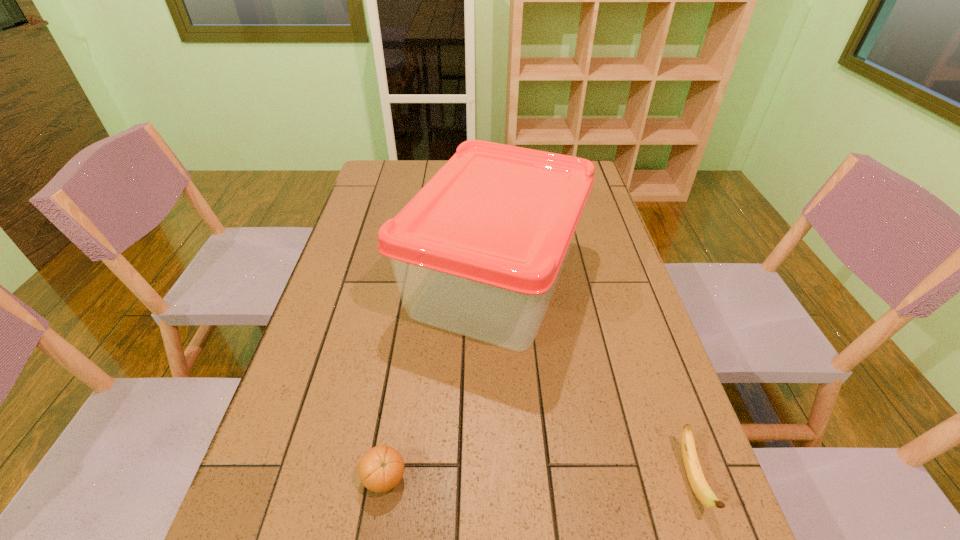
You are a GUI agent. You are given a task and a screenshot of the screen. Output one action in this format:
    pyautogui.click(x=<x>, y=<y>)
    Task: Click on the free area in between the tallest object and the banana
    This screenshot has height=540, width=960.
    Given the screenshot: What is the action you would take?
    pyautogui.click(x=593, y=380)

Locate an element on the screen. Image resolution: width=960 pixels, height=540 pixels. free space between the farthest object and the banana is located at coordinates (593, 380).

I want to click on unoccupied area between the orange and the rightmost object, so click(538, 479).

Image resolution: width=960 pixels, height=540 pixels. I want to click on vacant area that lies between the banana and the tray, so pyautogui.click(x=593, y=380).

This screenshot has width=960, height=540. Identify the location of free point between the banana and the tray. (593, 380).

Identify the location of free area in between the farthest object and the orange. The width and height of the screenshot is (960, 540). (440, 379).

This screenshot has width=960, height=540. Find the location of `free space that is in between the farthest object and the orange`. free space that is in between the farthest object and the orange is located at coordinates (440, 379).

The height and width of the screenshot is (540, 960). What are the coordinates of `free spot between the tray and the orange` in the screenshot? It's located at (440, 379).

This screenshot has width=960, height=540. In order to click on vacant space that's between the orange and the tray in this screenshot , I will do tap(440, 379).

Locate an element on the screen. This screenshot has width=960, height=540. empty space between the farthest object and the orange is located at coordinates (440, 379).